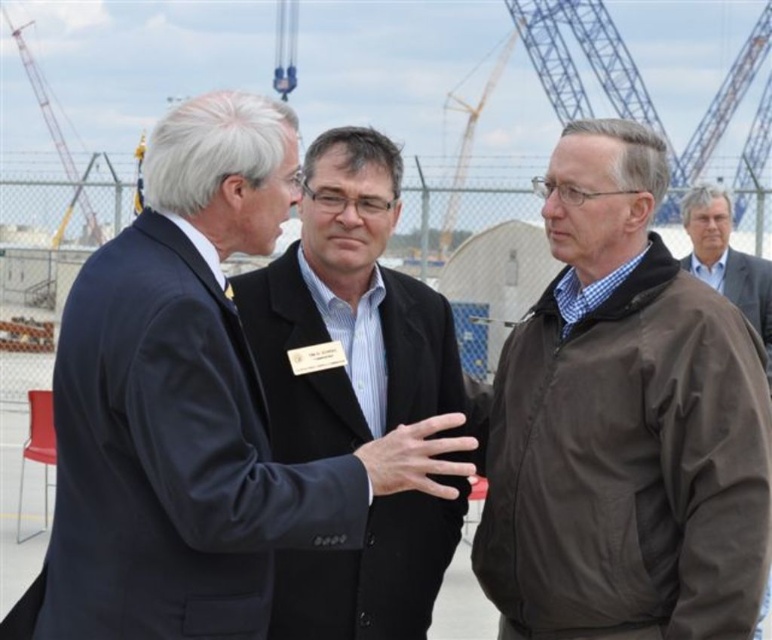
Question: Can you confirm if black smooth suit at center is positioned below brown leather jacket at right?

Choices:
 (A) yes
 (B) no

Answer: (A)

Question: Which point appears farthest from the camera in this image?

Choices:
 (A) (713, 195)
 (B) (153, 323)
 (C) (73, 168)

Answer: (C)

Question: Can you confirm if black smooth suit at center is thinner than brown leather jacket at right?

Choices:
 (A) yes
 (B) no

Answer: (B)

Question: Which point is closer to the camera?

Choices:
 (A) brown leather jacket at right
 (B) black smooth suit at center
 (C) dark blue suit at center

Answer: (C)

Question: Is brown matte jacket at center wider than metallic gray crane at upper left?

Choices:
 (A) yes
 (B) no

Answer: (B)

Question: Which object appears closest to the camera in this image?

Choices:
 (A) dark blue suit at center
 (B) brown matte jacket at center
 (C) metallic gray crane at upper left
 (D) brown leather jacket at right

Answer: (A)